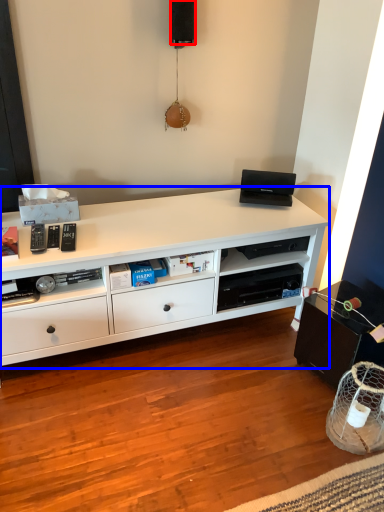
Question: Which of the following is the farthest to the observer, speaker (highlighted by a red box) or desk (highlighted by a blue box)?

Choices:
 (A) speaker
 (B) desk

Answer: (A)